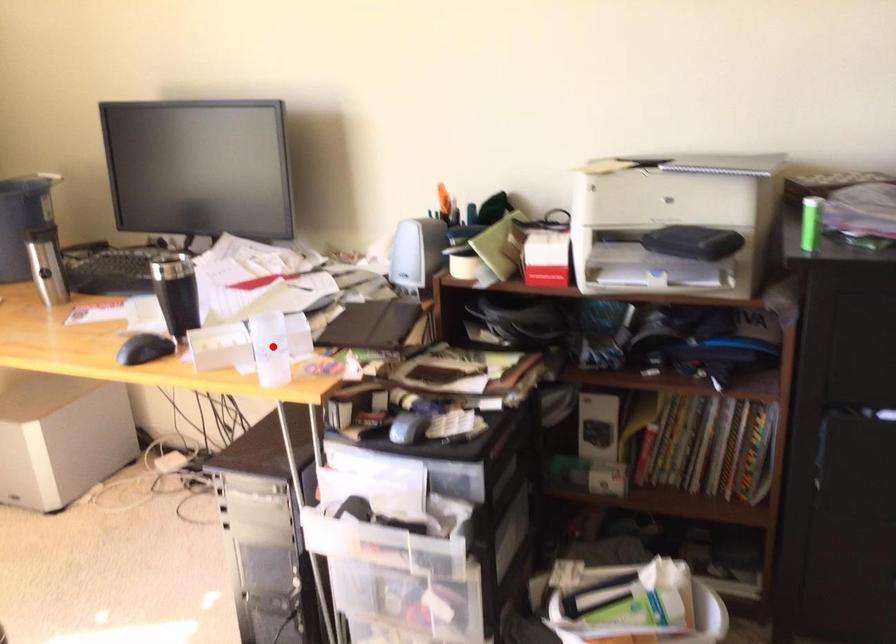
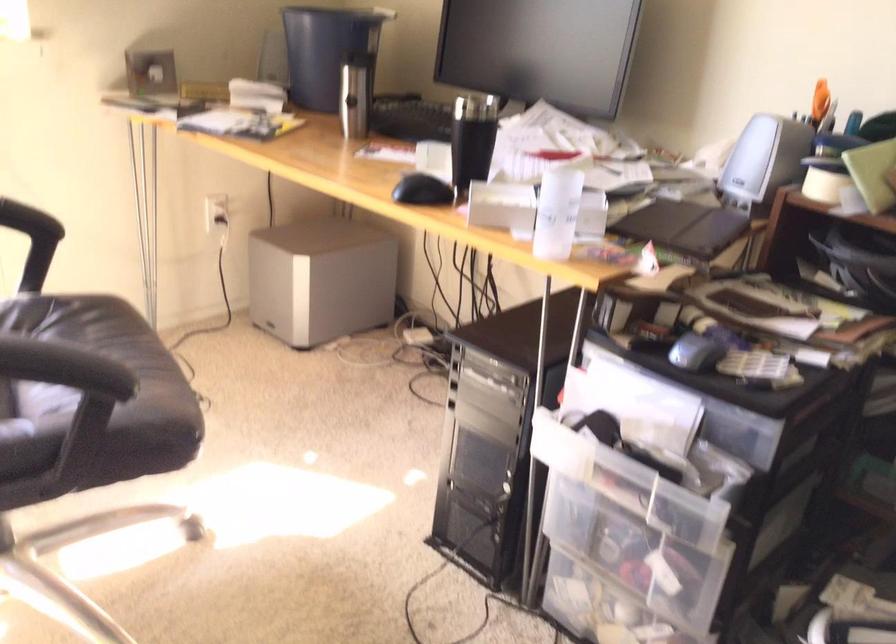
Question: I am providing you with two images of the same scene from different viewpoints. Image1 has a red point marked. In image2, the corresponding 3D location appears at what relative position? Reply with the corresponding letter.

Choices:
 (A) Closer
 (B) Farther

Answer: (A)